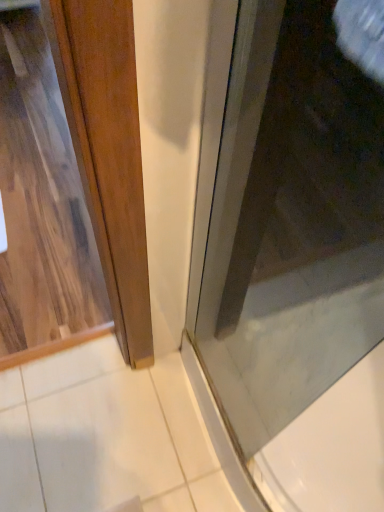
Describe the element at coordinates (42, 208) in the screenshot. This screenshot has width=384, height=512. I see `wooden cabinet at left` at that location.

Locate an element on the screen. The height and width of the screenshot is (512, 384). wooden cabinet at left is located at coordinates (42, 208).

This screenshot has width=384, height=512. What are the coordinates of `wooden cabinet at left` in the screenshot? It's located at (42, 208).